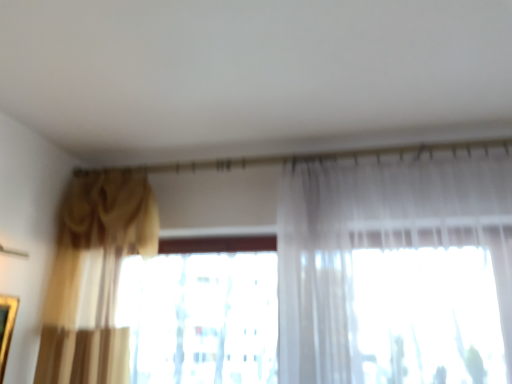
Question: From a real-world perspective, is translucent fabric at center physically below gold textured curtain at left?

Choices:
 (A) yes
 (B) no

Answer: (A)

Question: Can you confirm if translucent fabric at center is shorter than gold textured curtain at left?

Choices:
 (A) yes
 (B) no

Answer: (A)

Question: From the image's perspective, is translucent fabric at center on top of gold textured curtain at left?

Choices:
 (A) no
 (B) yes

Answer: (A)

Question: Is translucent fabric at center at the right side of gold textured curtain at left?

Choices:
 (A) yes
 (B) no

Answer: (A)

Question: Is translucent fabric at center to the left of gold textured curtain at left from the viewer's perspective?

Choices:
 (A) no
 (B) yes

Answer: (A)

Question: Is translucent fabric at center positioned behind gold textured curtain at left?

Choices:
 (A) no
 (B) yes

Answer: (B)

Question: Is gold textured curtain at left positioned in front of translucent fabric at center?

Choices:
 (A) no
 (B) yes

Answer: (B)

Question: Does gold textured curtain at left appear on the left side of translucent fabric at center?

Choices:
 (A) no
 (B) yes

Answer: (B)

Question: Would you say gold textured curtain at left is a long distance from translucent fabric at center?

Choices:
 (A) yes
 (B) no

Answer: (B)

Question: Is gold textured curtain at left at the right side of translucent fabric at center?

Choices:
 (A) no
 (B) yes

Answer: (A)

Question: Can you confirm if gold textured curtain at left is shorter than translucent fabric at center?

Choices:
 (A) yes
 (B) no

Answer: (B)

Question: Does gold textured curtain at left have a smaller size compared to translucent fabric at center?

Choices:
 (A) yes
 (B) no

Answer: (B)

Question: From the image's perspective, relative to translucent fabric at center, is gold textured curtain at left above or below?

Choices:
 (A) below
 (B) above

Answer: (B)